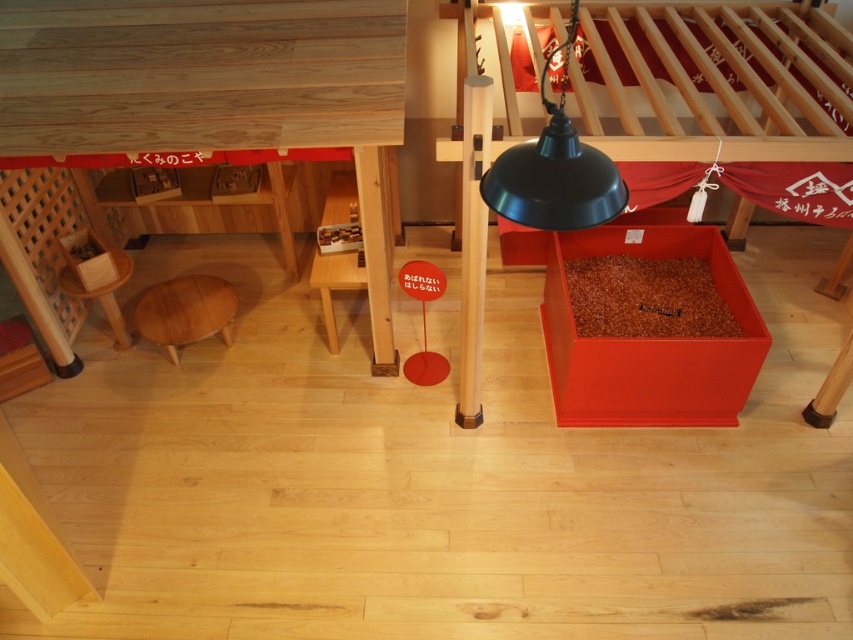
You are trying to decide whether to place a small plant between the black matte lamp at upper center and the light brown wooden stool at lower left. Considering their heights, which object should the plant be placed closer to for balance?

The black matte lamp at upper center is taller than the light brown wooden stool at lower left, so the plant should be placed closer to the light brown wooden stool at lower left to create visual balance.